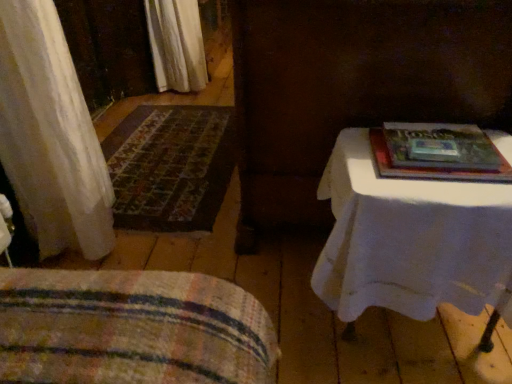
I want to click on vacant region above striped fabric blanket at lower left (from a real-world perspective), so point(86,313).